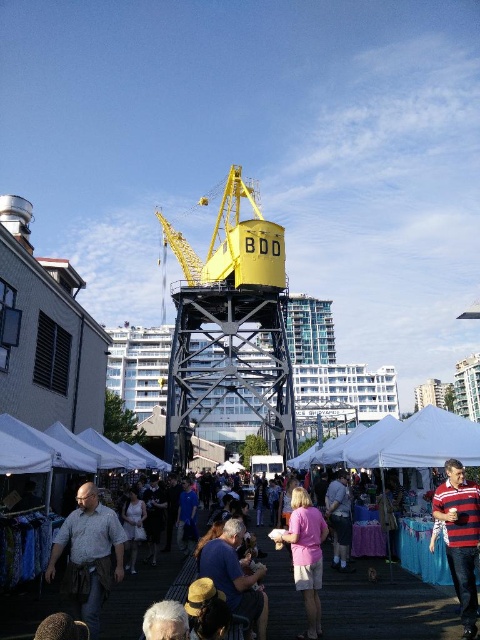
You are standing at the camera position observing the lively outdoor market scene. There is a specific point marked at coordinates point(81, 525). Can you determine whether this point is within a safe distance for a drone to land safely, considering the drone has a minimum safe landing distance requirement of 100 feet from any obstacles?

The point at point(81, 525) is 128.23 feet away from the camera position. Since the drone requires a minimum safe landing distance of 100 feet from obstacles, this point is beyond the required distance and thus safe for landing.